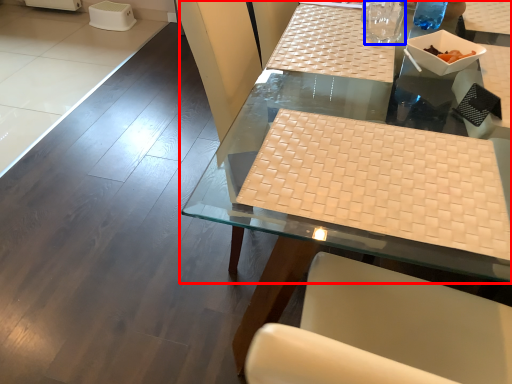
Question: Among these objects, which one is farthest to the camera, table (highlighted by a red box) or clear (highlighted by a blue box)?

Choices:
 (A) table
 (B) clear

Answer: (B)